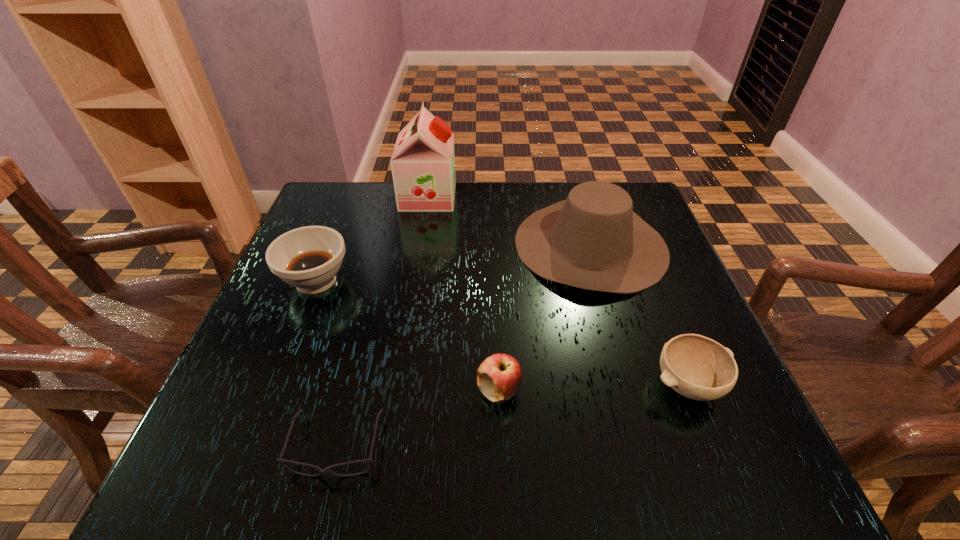
Locate an element on the screen. object situated at the far right corner is located at coordinates (593, 240).

Locate an element on the screen. vacant space at the far edge of the desktop is located at coordinates (505, 230).

Where is `blank space at the left edge of the desktop`? The height and width of the screenshot is (540, 960). blank space at the left edge of the desktop is located at coordinates (306, 333).

Identify the location of vacant space at the right edge. (653, 308).

Image resolution: width=960 pixels, height=540 pixels. Identify the location of vacant region at the near left corner of the desktop. (301, 433).

Identify the location of free region at the near right corner of the desktop. This screenshot has width=960, height=540. (668, 457).

Image resolution: width=960 pixels, height=540 pixels. What are the coordinates of `vacant area between the cowboy hat and the tallest object` in the screenshot? It's located at (509, 220).

You are a GUI agent. You are given a task and a screenshot of the screen. Output one action in this format:
    pyautogui.click(x=<x>, y=<y>)
    Task: Click on the vacant space in between the soup bowl and the apple
    The image size is (960, 540).
    Given the screenshot: What is the action you would take?
    pyautogui.click(x=408, y=335)

Find the location of a particular element. free space between the tallest object and the soup bowl is located at coordinates (372, 238).

In order to click on vacant space in between the fifth shortest object and the fourth object from left to right in this screenshot , I will do `click(545, 318)`.